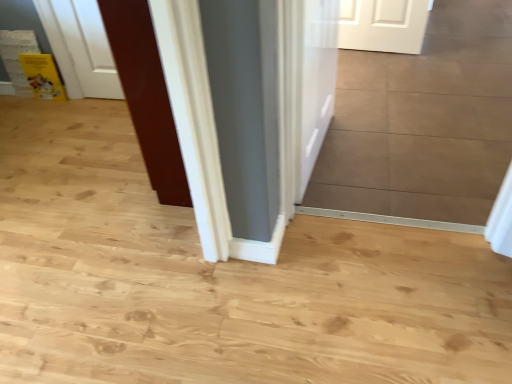
Locate an element on the screen. This screenshot has width=512, height=384. vacant space in front of white glossy door at center, which is the second door from left to right is located at coordinates (355, 183).